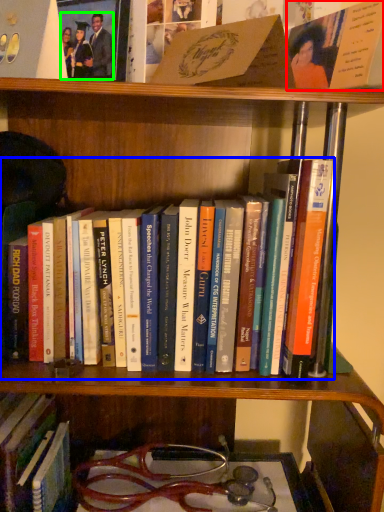
Question: Estimate the real-world distances between objects in this image. Which object is closer to book (highlighted by a red box), book (highlighted by a blue box) or couple (highlighted by a green box)?

Choices:
 (A) book
 (B) couple

Answer: (A)